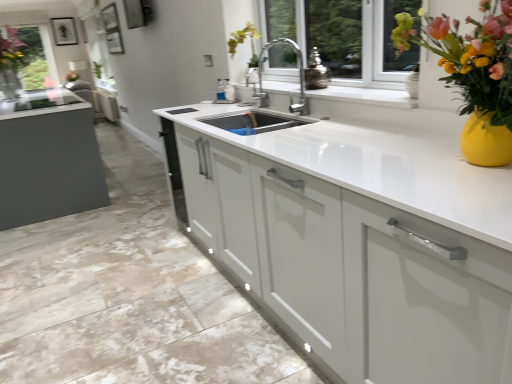
Where is `transparent glass window at upper left`? The height and width of the screenshot is (384, 512). transparent glass window at upper left is located at coordinates (23, 59).

What do you see at coordinates (473, 75) in the screenshot? Image resolution: width=512 pixels, height=384 pixels. I see `vibrant ceramic vase at upper right` at bounding box center [473, 75].

The height and width of the screenshot is (384, 512). What do you see at coordinates (358, 240) in the screenshot?
I see `white glossy cabinet at center, positioned as the first cabinetry in bottom-to-top order` at bounding box center [358, 240].

What do you see at coordinates (106, 104) in the screenshot? I see `white glossy cabinet at center, which is the second cabinetry from bottom to top` at bounding box center [106, 104].

Image resolution: width=512 pixels, height=384 pixels. I want to click on transparent glass window at upper left, so click(23, 59).

Is transparent glass window at upper left outside of white glossy cabinet at center, the first cabinetry viewed from the back?

transparent glass window at upper left is positioned outside white glossy cabinet at center, the first cabinetry viewed from the back.

Is point (28, 84) less distant than point (95, 105)?

Yes, it is in front of point (95, 105).

Is transparent glass window at upper left oriented away from white glossy cabinet at center, which is the 1th cabinetry in top-to-bottom order?

No, white glossy cabinet at center, which is the 1th cabinetry in top-to-bottom order, is not at the back of transparent glass window at upper left.

Is transparent glass window at upper left positioned far away from white glossy cabinet at center, the first cabinetry viewed from the back?

Actually, transparent glass window at upper left and white glossy cabinet at center, the first cabinetry viewed from the back, are a little close together.

Can vibrant ceramic vase at upper right be found inside white glossy cabinet at center, marked as the first cabinetry in a front-to-back arrangement?

No.

Are white glossy cabinet at center, marked as the first cabinetry in a front-to-back arrangement, and vibrant ceramic vase at upper right beside each other?

No, white glossy cabinet at center, marked as the first cabinetry in a front-to-back arrangement, is not making contact with vibrant ceramic vase at upper right.

How distant is white glossy cabinet at center, the 2th cabinetry from the back, from vibrant ceramic vase at upper right?

They are 21.49 inches apart.

From a real-world perspective, is white glossy cabinet at center, the second cabinetry viewed from the top, under vibrant ceramic vase at upper right?

Yes, from a real-world perspective, white glossy cabinet at center, the second cabinetry viewed from the top, is under vibrant ceramic vase at upper right.

Is white glossy cabinet at center, marked as the first cabinetry in a front-to-back arrangement, oriented towards white glossy cabinet at center, which is the 1th cabinetry in top-to-bottom order?

No, white glossy cabinet at center, marked as the first cabinetry in a front-to-back arrangement, is not turned towards white glossy cabinet at center, which is the 1th cabinetry in top-to-bottom order.

From the image's perspective, which is below, white glossy cabinet at center, the second cabinetry viewed from the top, or white glossy cabinet at center, arranged as the 2th cabinetry when viewed from the front?

From the image's view, white glossy cabinet at center, the second cabinetry viewed from the top, is below.

Can you tell me how much white glossy cabinet at center, the second cabinetry viewed from the top, and white glossy cabinet at center, the first cabinetry viewed from the back, differ in facing direction?

white glossy cabinet at center, the second cabinetry viewed from the top, and white glossy cabinet at center, the first cabinetry viewed from the back, are facing 88.3 degrees away from each other.

Considering the relative sizes of transparent glass window at upper left and vibrant ceramic vase at upper right in the image provided, is transparent glass window at upper left smaller than vibrant ceramic vase at upper right?

No.

From the image's perspective, is transparent glass window at upper left located above vibrant ceramic vase at upper right?

Yes.

From a real-world perspective, does transparent glass window at upper left sit lower than vibrant ceramic vase at upper right?

Incorrect, from a real-world perspective, transparent glass window at upper left is higher than vibrant ceramic vase at upper right.

Is transparent glass window at upper left positioned in front of white glossy cabinet at center, marked as the first cabinetry in a front-to-back arrangement?

No, transparent glass window at upper left is further to the viewer.

Is transparent glass window at upper left in contact with white glossy cabinet at center, positioned as the first cabinetry in bottom-to-top order?

transparent glass window at upper left and white glossy cabinet at center, positioned as the first cabinetry in bottom-to-top order, are clearly separated.

Is white glossy cabinet at center, the second cabinetry viewed from the top, surrounded by transparent glass window at upper left?

Definitely not — white glossy cabinet at center, the second cabinetry viewed from the top, is not inside transparent glass window at upper left.

Are vibrant ceramic vase at upper right and white glossy cabinet at center, which is the second cabinetry from bottom to top, making contact?

No, vibrant ceramic vase at upper right is not beside white glossy cabinet at center, which is the second cabinetry from bottom to top.

Which object is closer to the camera taking this photo, vibrant ceramic vase at upper right or white glossy cabinet at center, arranged as the 2th cabinetry when viewed from the front?

Positioned in front is vibrant ceramic vase at upper right.

Which object is wider, vibrant ceramic vase at upper right or white glossy cabinet at center, the first cabinetry viewed from the back?

Wider between the two is vibrant ceramic vase at upper right.

Is vibrant ceramic vase at upper right oriented towards white glossy cabinet at center, which is the second cabinetry from bottom to top?

No, vibrant ceramic vase at upper right is not turned towards white glossy cabinet at center, which is the second cabinetry from bottom to top.

From a real-world perspective, who is located lower, vibrant ceramic vase at upper right or transparent glass window at upper left?

vibrant ceramic vase at upper right is physically lower.

Is vibrant ceramic vase at upper right taller than transparent glass window at upper left?

No, vibrant ceramic vase at upper right is not taller than transparent glass window at upper left.

Between point (456, 31) and point (50, 87), which one is positioned in front?

The point (456, 31) is closer.

Is vibrant ceramic vase at upper right oriented away from transparent glass window at upper left?

No, vibrant ceramic vase at upper right is not facing away from transparent glass window at upper left.

Find the location of a particular element. window screen that appears above the white glossy cabinet at center, which is the 1th cabinetry in top-to-bottom order (from a real-world perspective) is located at coordinates (23, 59).

Find the location of `the 1st cabinetry to the left of the vibrant ceramic vase at upper right, starting your count from the anchor`. the 1st cabinetry to the left of the vibrant ceramic vase at upper right, starting your count from the anchor is located at coordinates pyautogui.click(x=358, y=240).

Which object lies nearer to the anchor point white glossy cabinet at center, the 2th cabinetry from the back, white glossy cabinet at center, which is the 1th cabinetry in top-to-bottom order, or vibrant ceramic vase at upper right?

Among the two, vibrant ceramic vase at upper right is located nearer to white glossy cabinet at center, the 2th cabinetry from the back.

From the image, which object appears to be farther from transparent glass window at upper left, white glossy cabinet at center, marked as the first cabinetry in a front-to-back arrangement, or vibrant ceramic vase at upper right?

vibrant ceramic vase at upper right is further to transparent glass window at upper left.

Estimate the real-world distances between objects in this image. Which object is further from vibrant ceramic vase at upper right, white glossy cabinet at center, which is the second cabinetry from bottom to top, or white glossy cabinet at center, positioned as the first cabinetry in bottom-to-top order?

white glossy cabinet at center, which is the second cabinetry from bottom to top, is positioned further to the anchor vibrant ceramic vase at upper right.

Looking at this image, based on their spatial positions, is white glossy cabinet at center, the 2th cabinetry from the back, or transparent glass window at upper left closer to white glossy cabinet at center, which is the 1th cabinetry in top-to-bottom order?

transparent glass window at upper left lies closer to white glossy cabinet at center, which is the 1th cabinetry in top-to-bottom order, than the other object.

From the image, which object appears to be nearer to white glossy cabinet at center, which is the second cabinetry from bottom to top, white glossy cabinet at center, positioned as the first cabinetry in bottom-to-top order, or vibrant ceramic vase at upper right?

white glossy cabinet at center, positioned as the first cabinetry in bottom-to-top order, lies closer to white glossy cabinet at center, which is the second cabinetry from bottom to top, than the other object.

Based on their spatial positions, is vibrant ceramic vase at upper right or white glossy cabinet at center, the second cabinetry viewed from the top, closer to white glossy cabinet at center, which is the second cabinetry from bottom to top?

white glossy cabinet at center, the second cabinetry viewed from the top, is positioned closer to the anchor white glossy cabinet at center, which is the second cabinetry from bottom to top.

From the image, which object appears to be nearer to white glossy cabinet at center, positioned as the first cabinetry in bottom-to-top order, transparent glass window at upper left or vibrant ceramic vase at upper right?

vibrant ceramic vase at upper right is closer to white glossy cabinet at center, positioned as the first cabinetry in bottom-to-top order.

Considering their positions, is vibrant ceramic vase at upper right positioned further to transparent glass window at upper left than white glossy cabinet at center, which is the 1th cabinetry in top-to-bottom order?

vibrant ceramic vase at upper right.

This screenshot has height=384, width=512. What are the coordinates of `window screen positioned between white glossy cabinet at center, the second cabinetry viewed from the top, and white glossy cabinet at center, arranged as the 2th cabinetry when viewed from the front, from near to far` in the screenshot? It's located at (23, 59).

The height and width of the screenshot is (384, 512). I want to click on cabinetry positioned between vibrant ceramic vase at upper right and transparent glass window at upper left from near to far, so click(x=358, y=240).

The height and width of the screenshot is (384, 512). In order to click on cabinetry between vibrant ceramic vase at upper right and white glossy cabinet at center, which is the 1th cabinetry in top-to-bottom order, from front to back in this screenshot , I will do `click(358, 240)`.

I want to click on window screen positioned between vibrant ceramic vase at upper right and white glossy cabinet at center, which is the second cabinetry from bottom to top, from near to far, so click(x=23, y=59).